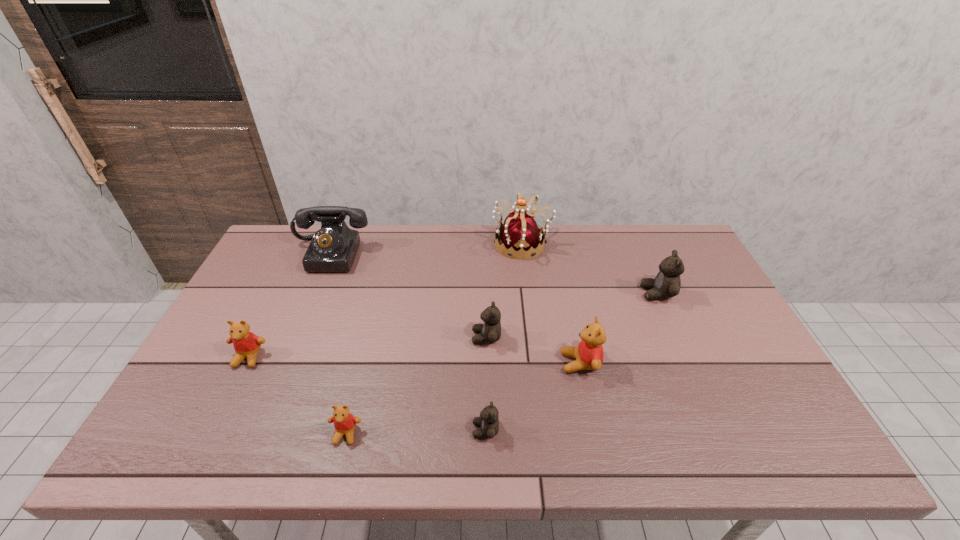
Find the location of a particular element. red tiara is located at coordinates coord(520,236).

Locate an element on the screen. This screenshot has height=540, width=960. the tallest object is located at coordinates (520, 236).

Image resolution: width=960 pixels, height=540 pixels. Identify the location of telephone. (333, 248).

Locate an element on the screen. This screenshot has width=960, height=540. the farthest teddy bear is located at coordinates (667, 283).

Where is `the rightmost object`? Image resolution: width=960 pixels, height=540 pixels. the rightmost object is located at coordinates (667, 283).

You are a GUI agent. You are given a task and a screenshot of the screen. Output one action in this format:
    pyautogui.click(x=<x>, y=<y>)
    Task: Click on the biggest red teddy bear
    This screenshot has height=540, width=960.
    Given the screenshot: What is the action you would take?
    pyautogui.click(x=588, y=355)

You are a GUI agent. You are given a task and a screenshot of the screen. Output one action in this format:
    pyautogui.click(x=<x>, y=<y>)
    Task: Click on the fifth teddy bear from left to right
    
    Given the screenshot: What is the action you would take?
    pyautogui.click(x=588, y=355)

Locate an element on the screen. The image size is (960, 540). the second biggest brown teddy bear is located at coordinates (490, 331).

Where is `the leftmost red teddy bear`? The height and width of the screenshot is (540, 960). the leftmost red teddy bear is located at coordinates (246, 344).

You are a GUI agent. You are given a task and a screenshot of the screen. Output one action in this format:
    pyautogui.click(x=<x>, y=<y>)
    Task: Click on the second smallest red teddy bear
    Image resolution: width=960 pixels, height=540 pixels.
    Given the screenshot: What is the action you would take?
    pyautogui.click(x=246, y=344)